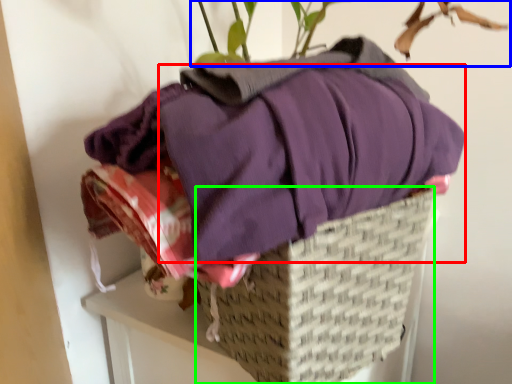
Question: Which object is the farthest from clothing (highlighted by a red box)? Choose among these: houseplant (highlighted by a blue box) or basket (highlighted by a green box).

Choices:
 (A) houseplant
 (B) basket

Answer: (A)